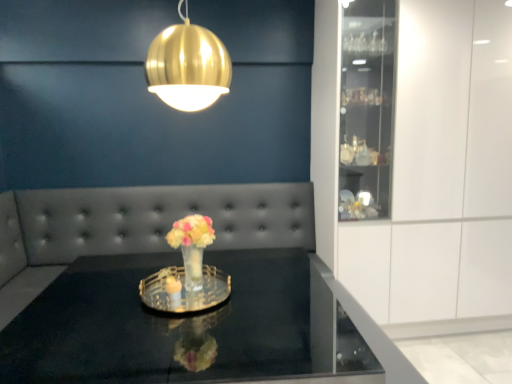
Question: Is translucent glass vase at center in front of gold metallic sphere at upper center?

Choices:
 (A) yes
 (B) no

Answer: (B)

Question: Considering the relative sizes of translucent glass vase at center and gold metallic sphere at upper center in the image provided, is translucent glass vase at center taller than gold metallic sphere at upper center?

Choices:
 (A) yes
 (B) no

Answer: (B)

Question: Does translucent glass vase at center have a lesser height compared to gold metallic sphere at upper center?

Choices:
 (A) yes
 (B) no

Answer: (A)

Question: Is translucent glass vase at center behind gold metallic sphere at upper center?

Choices:
 (A) yes
 (B) no

Answer: (A)

Question: Is translucent glass vase at center looking in the opposite direction of gold metallic sphere at upper center?

Choices:
 (A) yes
 (B) no

Answer: (B)

Question: Is translucent glass vase at center oriented towards gold metallic sphere at upper center?

Choices:
 (A) no
 (B) yes

Answer: (A)

Question: Can you confirm if clear glass tray at center is shorter than clear glass vase at center?

Choices:
 (A) no
 (B) yes

Answer: (B)

Question: Can you confirm if clear glass tray at center is thinner than clear glass vase at center?

Choices:
 (A) no
 (B) yes

Answer: (B)

Question: From a real-world perspective, is clear glass tray at center over clear glass vase at center?

Choices:
 (A) yes
 (B) no

Answer: (A)

Question: Is clear glass tray at center to the left of clear glass vase at center from the viewer's perspective?

Choices:
 (A) no
 (B) yes

Answer: (A)

Question: Considering the relative positions of clear glass tray at center and clear glass vase at center in the image provided, is clear glass tray at center behind clear glass vase at center?

Choices:
 (A) yes
 (B) no

Answer: (B)

Question: Does clear glass tray at center have a larger size compared to clear glass vase at center?

Choices:
 (A) yes
 (B) no

Answer: (B)

Question: Can you confirm if black glass table at center is thinner than clear glass vase at center?

Choices:
 (A) no
 (B) yes

Answer: (A)